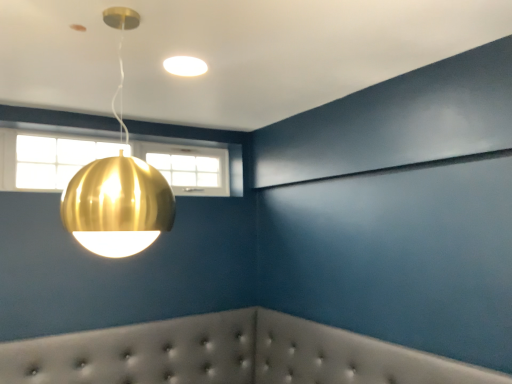
Question: Relative to white tufted headboard at lower center, is matte white light fixture at upper center, the second lamp from the bottom, in front or behind?

Choices:
 (A) front
 (B) behind

Answer: (B)

Question: Does point (166, 67) appear closer or farther from the camera than point (103, 339)?

Choices:
 (A) farther
 (B) closer

Answer: (B)

Question: Based on their relative distances, which object is nearer to the matte white light fixture at upper center, which is counted as the 1th lamp, starting from the back?

Choices:
 (A) clear glass window at upper left
 (B) gold metallic sphere at upper center, which appears as the first lamp when viewed from the front
 (C) white tufted headboard at lower center

Answer: (B)

Question: Which object is the closest to the clear glass window at upper left?

Choices:
 (A) white tufted headboard at lower center
 (B) gold metallic sphere at upper center, the 1th lamp from the bottom
 (C) matte white light fixture at upper center, the second lamp from the bottom

Answer: (C)